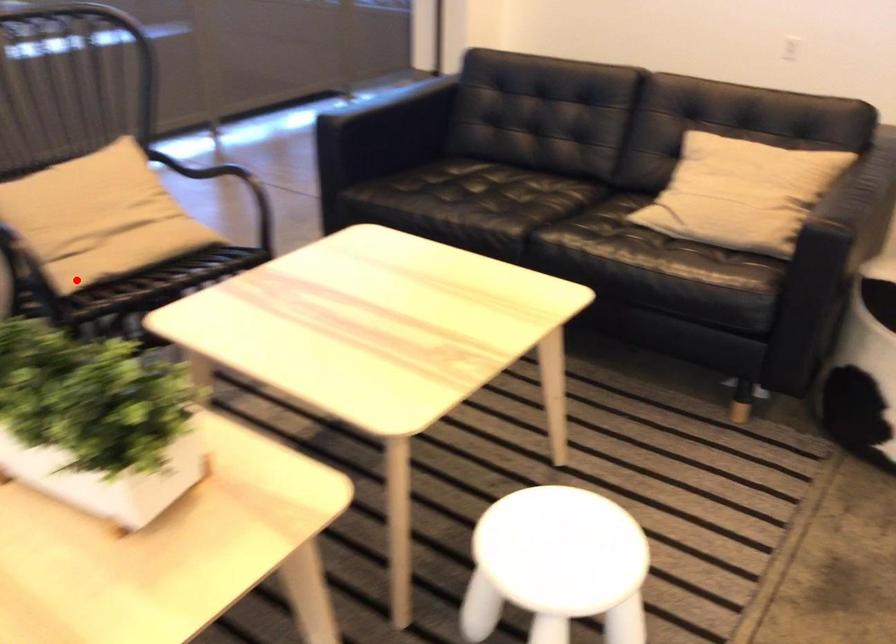
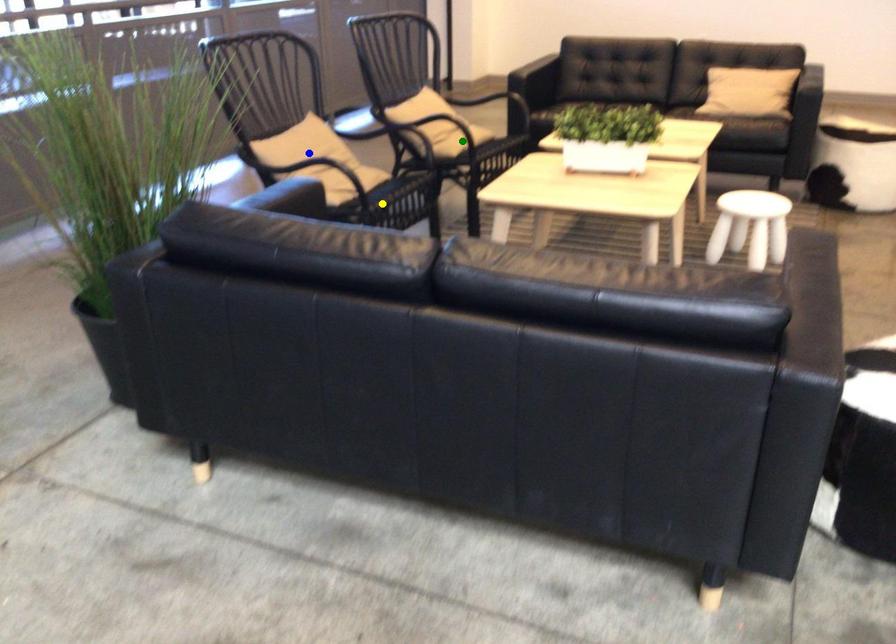
Question: I am providing you with two images of the same scene from different viewpoints. A red point is marked on the first image. You are given multiple points on the second image. Which mark in image 2 goes with the point in image 1?

Choices:
 (A) green point
 (B) yellow point
 (C) blue point

Answer: (A)